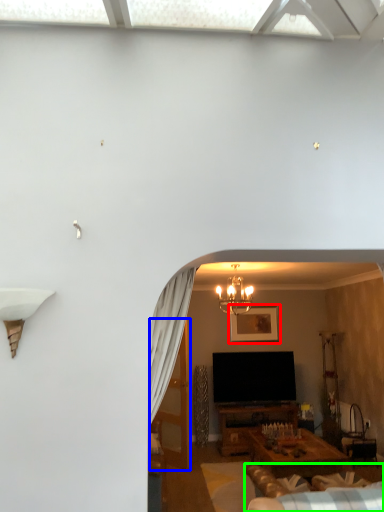
Question: Which object is positioned closest to picture frame (highlighted by a red box)? Select from glass door (highlighted by a blue box) and couch (highlighted by a green box).

Choices:
 (A) glass door
 (B) couch

Answer: (A)